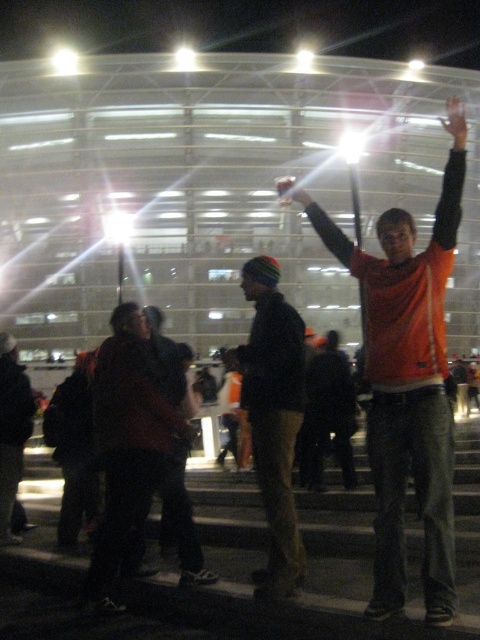
You are at the bottom of the steps leading to the building and want to greet the person wearing the orange matte shirt at center. Which direction should you walk relative to the knit cap at center to reach them?

You should walk to the right of the knit cap at center to reach the orange matte shirt at center, as the orange matte shirt at center is positioned to the right of the knit cap at center.